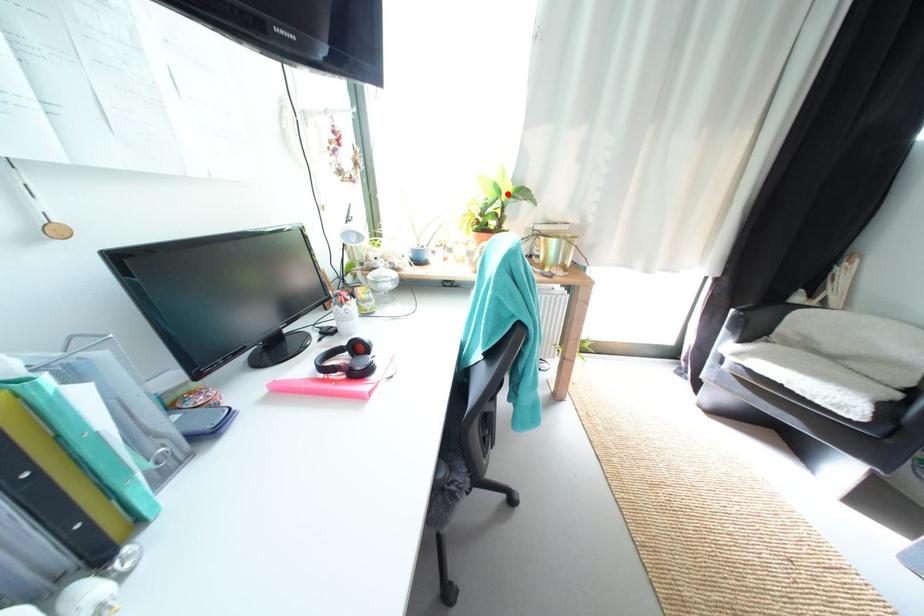
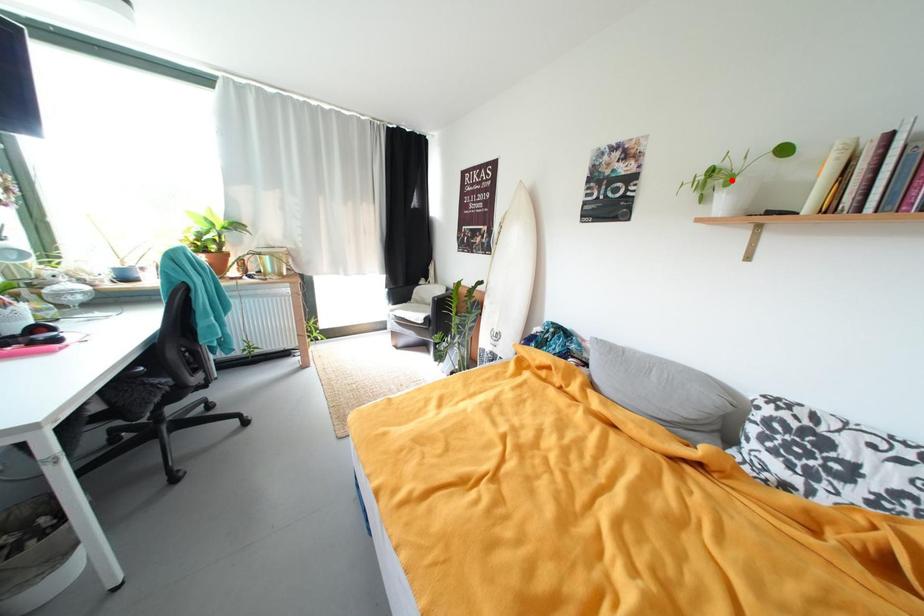
I am providing you with two images of the same scene from different viewpoints. A red point is marked on the first image and another point is marked on the second image. Are the points marked in image1 and image2 representing the same 3D position?

No